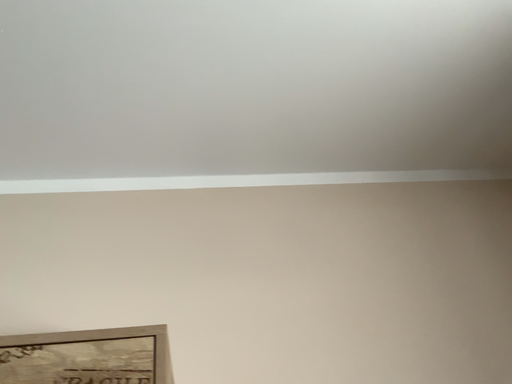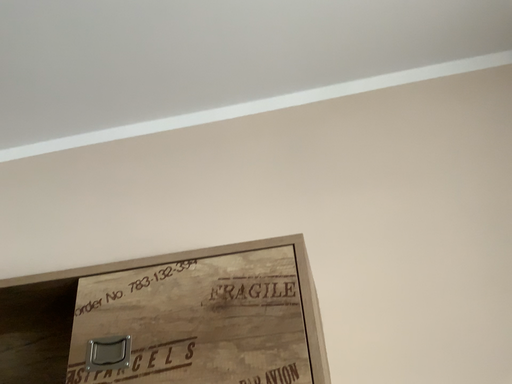
Question: How did the camera likely rotate when shooting the video?

Choices:
 (A) rotated right
 (B) rotated left

Answer: (B)